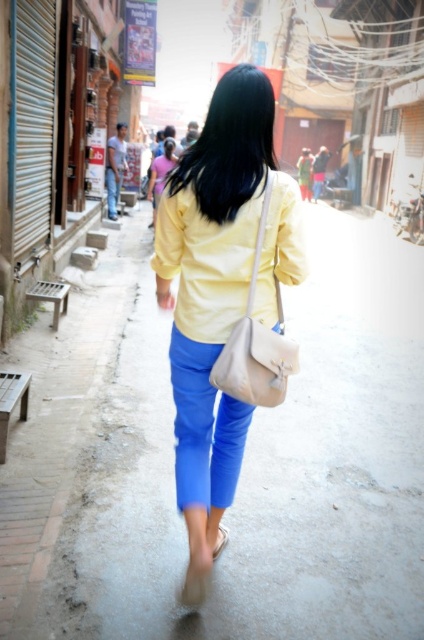
Question: Does matte yellow shirt at center come behind matte pink blouse at center?

Choices:
 (A) yes
 (B) no

Answer: (B)

Question: Which of the following is the closest to the observer?

Choices:
 (A) beige leather shoulder bag at center
 (B) black silky hair at upper center
 (C) matte yellow shirt at center

Answer: (A)

Question: Which point is farther to the camera?

Choices:
 (A) matte pink blouse at center
 (B) matte yellow shirt at center
 (C) dull concrete pavement at center

Answer: (A)

Question: Is black smooth hair at upper center to the right of beige leather shoulder bag at center from the viewer's perspective?

Choices:
 (A) no
 (B) yes

Answer: (A)

Question: In this image, where is black smooth hair at upper center located relative to beige leather shoulder bag at center?

Choices:
 (A) left
 (B) right

Answer: (A)

Question: Based on their relative distances, which object is nearer to the yellow matte jacket at center?

Choices:
 (A) black silky hair at upper center
 (B) black smooth hair at upper center

Answer: (B)